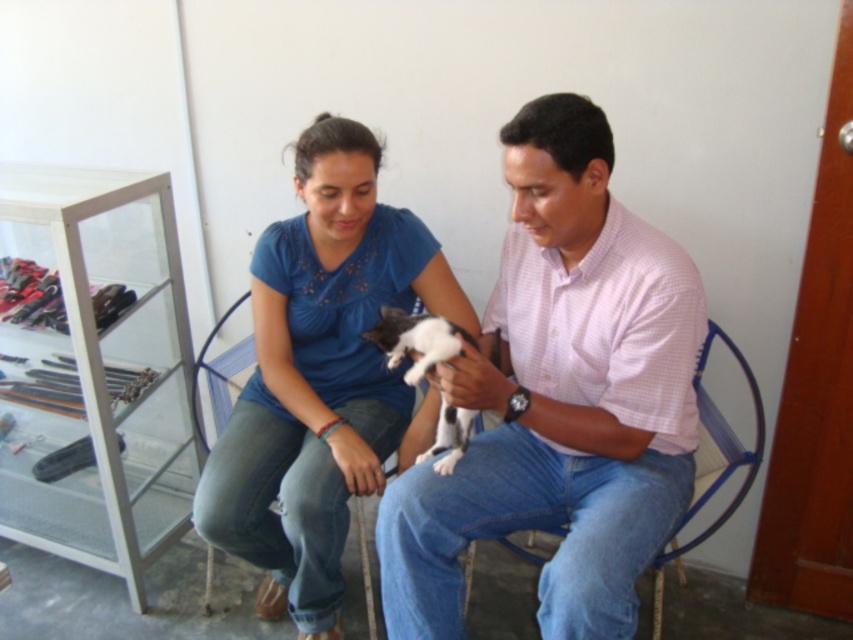
You are a photographer setting up a shoot in this room. You need to position a light source so that it illuminates the pink checkered shirt at center and the blue cotton shirt at center equally. Given their positions, which shirt should you place the light closer to?

The pink checkered shirt at center is in front of the blue cotton shirt at center, so the light should be placed closer to the blue cotton shirt at center to ensure both shirts receive equal illumination.

You are trying to decide if the black and white fur cat at center can fit entirely on the blue mesh chair at center. Based on their sizes, what do you think?

The black and white fur cat at center might be wider than blue mesh chair at center, so there is a possibility that the cat may not fit entirely on the chair.